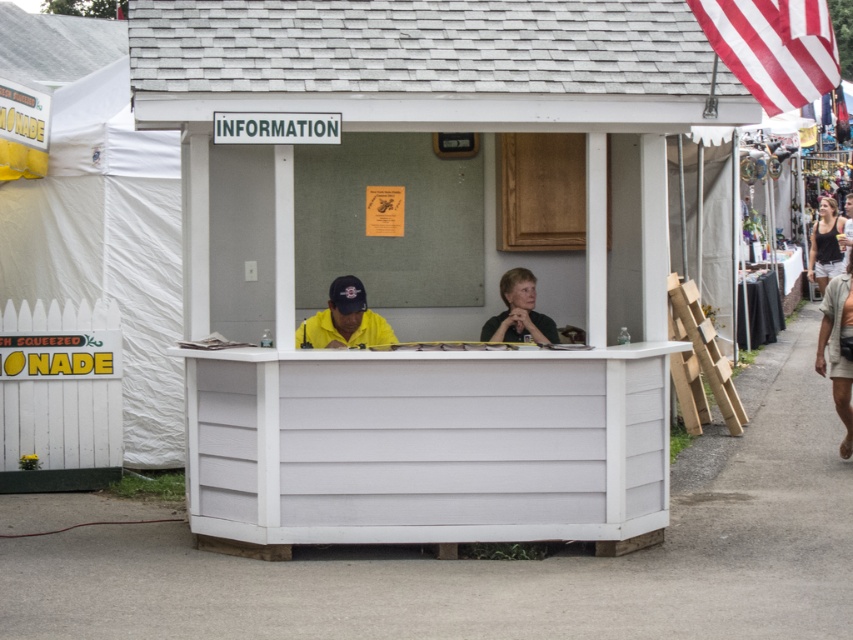
You are standing outside the white wood information booth at center and want to see the yellow matte shirt at center. Can you see it without moving your head?

The white wood information booth at center is in front of the yellow matte shirt at center, so the yellow matte shirt at center is behind the booth and not visible from outside.

You are standing outside the information booth and want to know which of the two points, point (357, 337) or point (842, 291), is closer to you. Based on the coordinates provided, can you determine which point is nearer?

Point (357, 337) is in front of point (842, 291), so it is closer to you.

You are a visitor at the fair and want to ask for directions. You see the yellow matte shirt at center and the denim shorts at right. Which one should you approach for assistance?

The yellow matte shirt at center is closer to you than the denim shorts at right, so you should approach the yellow matte shirt at center for assistance.